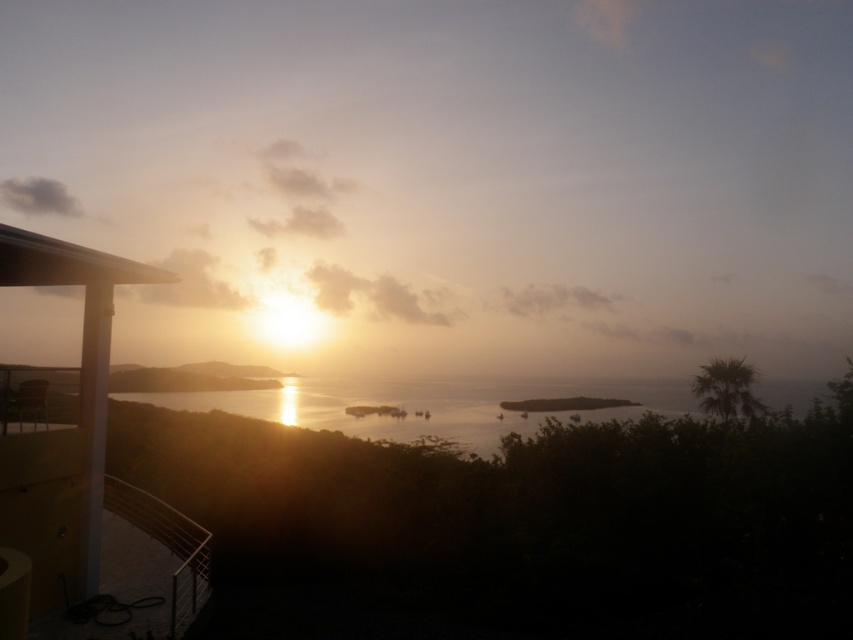
Does matte yellow balcony at left lie in front of silvery reflective water at center?

Yes, matte yellow balcony at left is closer to the viewer.

Does matte yellow balcony at left have a lesser height compared to silvery reflective water at center?

Incorrect, matte yellow balcony at left's height does not fall short of silvery reflective water at center's.

Find the location of a particular element. matte yellow balcony at left is located at coordinates (67, 433).